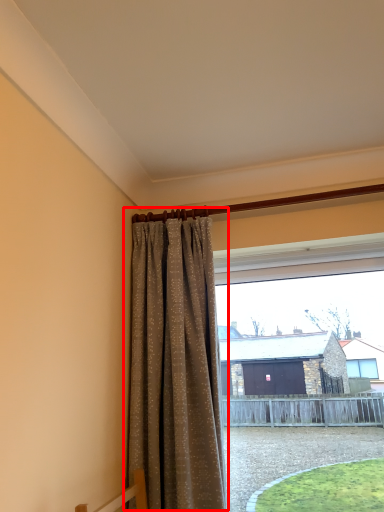
Question: Observing the image, what is the correct spatial positioning of curtain (annotated by the red box) in reference to window?

Choices:
 (A) left
 (B) right

Answer: (A)